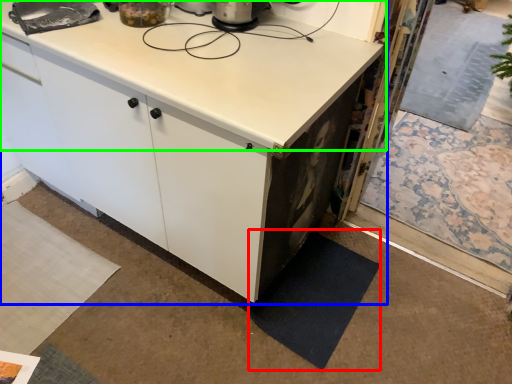
Question: Based on their relative distances, which object is farther from mat (highlighted by a red box)? Choose from cabinetry (highlighted by a blue box) and countertop (highlighted by a green box).

Choices:
 (A) cabinetry
 (B) countertop

Answer: (B)